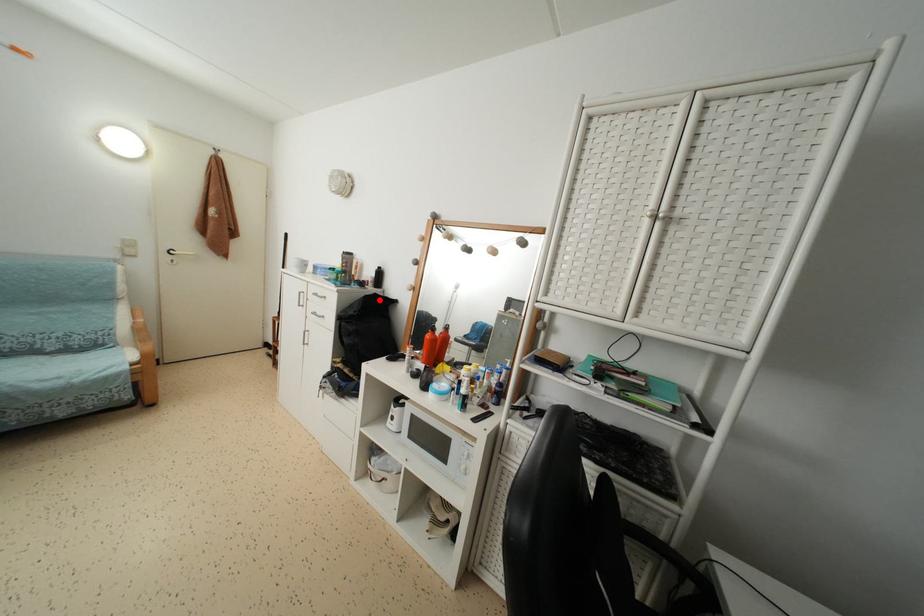
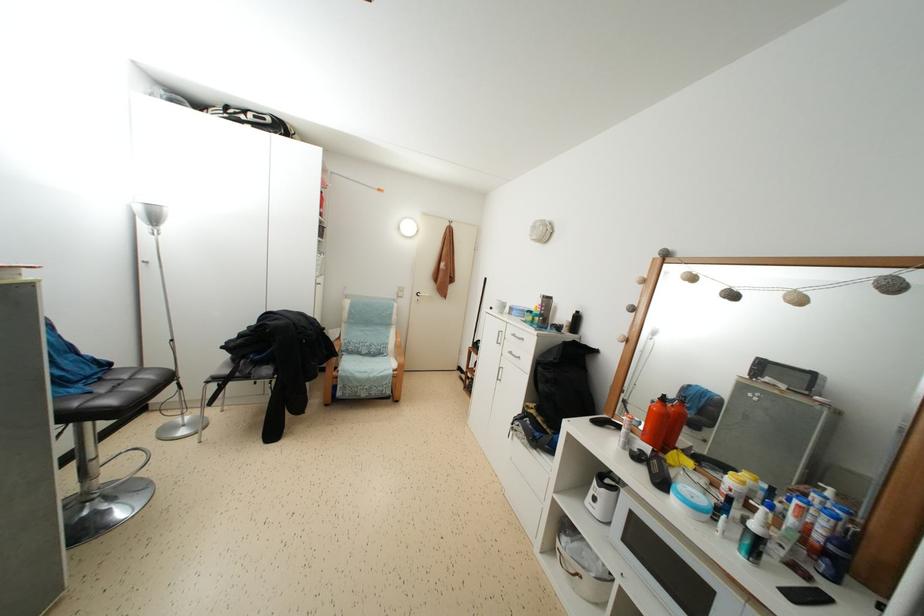
Where in the second image is the point corresponding to the highlighted location from the first image?

(578, 347)